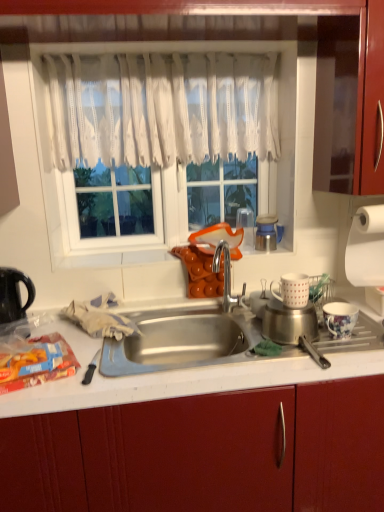
Question: Should I look upward or downward to see translucent plastic bag of frozen vegetables at lower left?

Choices:
 (A) up
 (B) down

Answer: (B)

Question: From the image's perspective, does white matte mug at right, which is the fourth appliance from right to left, appear lower than black plastic kettle at left?

Choices:
 (A) no
 (B) yes

Answer: (A)

Question: From a real-world perspective, is white matte mug at right, the second appliance in the left-to-right sequence, physically above black plastic kettle at left?

Choices:
 (A) no
 (B) yes

Answer: (B)

Question: Can you confirm if white matte mug at right, which is the fourth appliance from right to left, is shorter than black plastic kettle at left?

Choices:
 (A) yes
 (B) no

Answer: (A)

Question: Does white matte mug at right, which is the fourth appliance from right to left, have a greater height compared to black plastic kettle at left?

Choices:
 (A) no
 (B) yes

Answer: (A)

Question: From a real-world perspective, is white matte mug at right, the second appliance in the left-to-right sequence, located beneath black plastic kettle at left?

Choices:
 (A) no
 (B) yes

Answer: (A)

Question: Does white matte mug at right, the second appliance in the left-to-right sequence, lie in front of black plastic kettle at left?

Choices:
 (A) yes
 (B) no

Answer: (A)

Question: Does white lace curtain at upper center have a lesser width compared to translucent plastic bag of frozen vegetables at lower left?

Choices:
 (A) no
 (B) yes

Answer: (B)

Question: Can translucent plastic bag of frozen vegetables at lower left be found inside white lace curtain at upper center?

Choices:
 (A) no
 (B) yes

Answer: (A)

Question: From a real-world perspective, is white lace curtain at upper center physically below translucent plastic bag of frozen vegetables at lower left?

Choices:
 (A) no
 (B) yes

Answer: (A)

Question: Is white lace curtain at upper center located outside translucent plastic bag of frozen vegetables at lower left?

Choices:
 (A) yes
 (B) no

Answer: (A)

Question: Can you confirm if white lace curtain at upper center is smaller than translucent plastic bag of frozen vegetables at lower left?

Choices:
 (A) no
 (B) yes

Answer: (A)

Question: From a real-world perspective, is white lace curtain at upper center on top of translucent plastic bag of frozen vegetables at lower left?

Choices:
 (A) no
 (B) yes

Answer: (B)

Question: From the image's perspective, is orange matte cups at center under white matte mug at right, which is the fourth appliance from right to left?

Choices:
 (A) no
 (B) yes

Answer: (A)